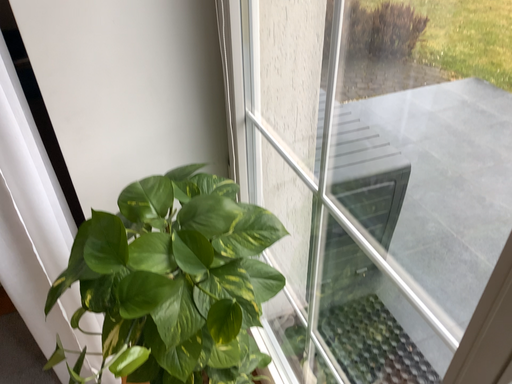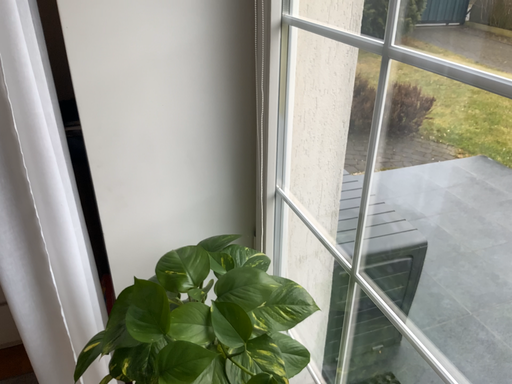
Question: How did the camera likely rotate when shooting the video?

Choices:
 (A) rotated downward
 (B) rotated upward

Answer: (B)